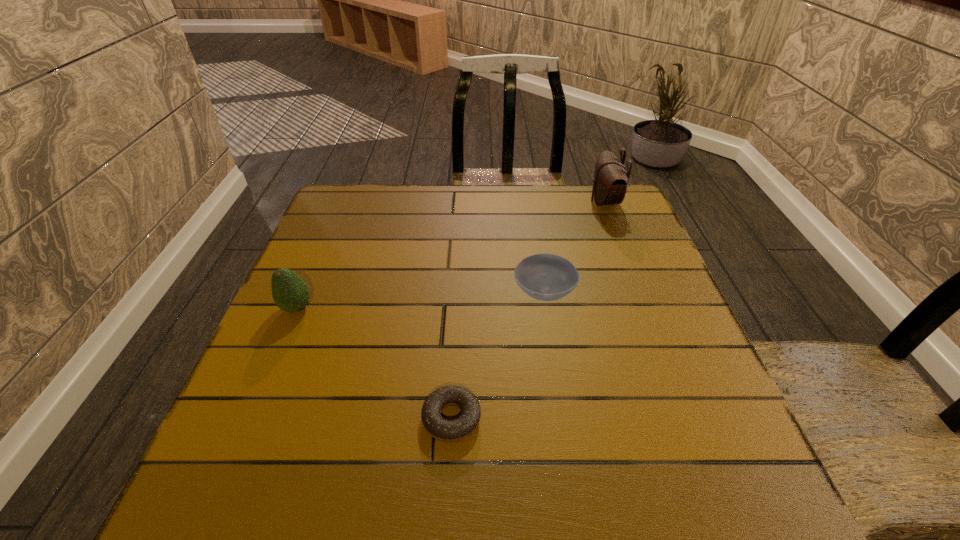
In order to click on empty space between the third shortest object and the rightmost object in this screenshot , I will do `click(450, 255)`.

Locate an element on the screen. empty location between the farthest object and the second shortest object is located at coordinates (574, 247).

You are a GUI agent. You are given a task and a screenshot of the screen. Output one action in this format:
    pyautogui.click(x=<x>, y=<y>)
    Task: Click on the vacant area that lies between the farthest object and the bowl
    Image resolution: width=960 pixels, height=540 pixels.
    Given the screenshot: What is the action you would take?
    pyautogui.click(x=574, y=247)

This screenshot has height=540, width=960. I want to click on object that ranks as the closest to the tallest object, so click(546, 277).

Locate an element on the screen. The image size is (960, 540). object that can be found as the second closest to the second shortest object is located at coordinates (611, 178).

Locate an element on the screen. free space that satisfies the following two spatial constraints: 1. on the front side of the second tallest object; 2. on the left side of the shortest object is located at coordinates (250, 418).